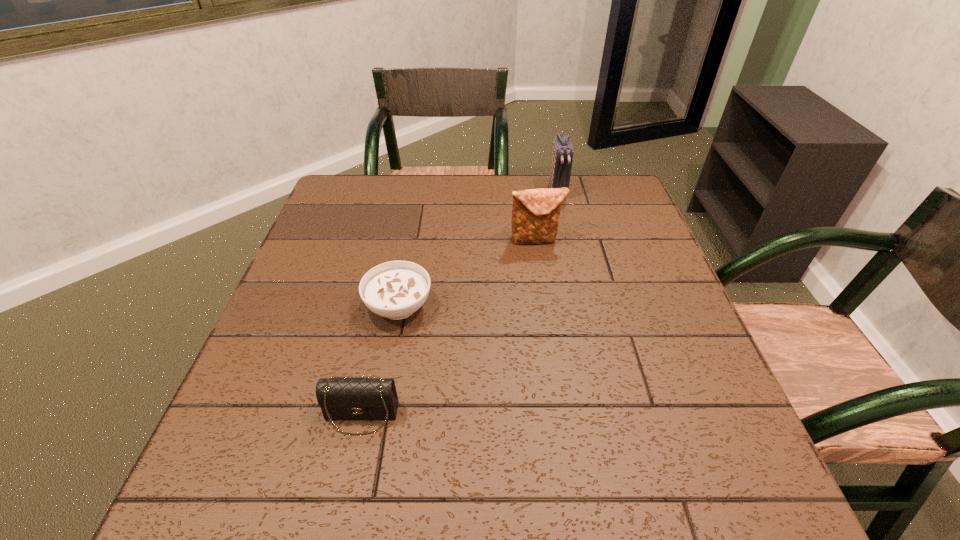
Where is `the farthest object`? The width and height of the screenshot is (960, 540). the farthest object is located at coordinates (562, 159).

The image size is (960, 540). In order to click on the third nearest object in this screenshot , I will do `click(535, 215)`.

Find the location of a particular element. Image resolution: width=960 pixels, height=540 pixels. the leftmost clutch bag is located at coordinates (341, 398).

Where is `the nearest object`? the nearest object is located at coordinates (341, 398).

Locate an element on the screen. The height and width of the screenshot is (540, 960). soup bowl is located at coordinates (396, 289).

Locate an element on the screen. The width and height of the screenshot is (960, 540). the shortest object is located at coordinates (396, 289).

Locate an element on the screen. The image size is (960, 540). vacant space situated 0.330m with the zip open on the farthest clutch bag is located at coordinates (577, 278).

The height and width of the screenshot is (540, 960). Identify the location of vacant space located on the open side of the second nearest clutch bag. (551, 342).

Identify the location of blank area located on the front flap of the nearest object. This screenshot has width=960, height=540. (345, 495).

Where is `free spot located on the front of the soup bowl`? This screenshot has height=540, width=960. free spot located on the front of the soup bowl is located at coordinates (384, 385).